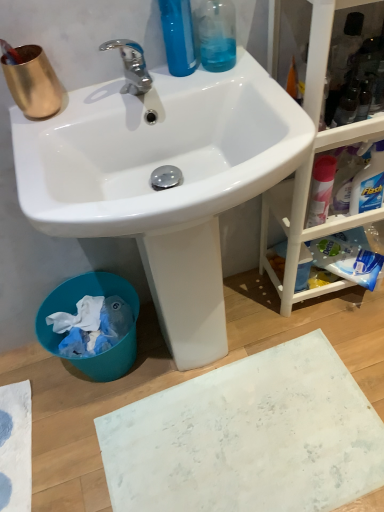
You are a GUI agent. You are given a task and a screenshot of the screen. Output one action in this format:
    pyautogui.click(x=<x>, y=<y>)
    Task: Click on the free space that is to the left of blue plastic trash bin at lower left
    The image size is (384, 512).
    Given the screenshot: What is the action you would take?
    pyautogui.click(x=31, y=384)